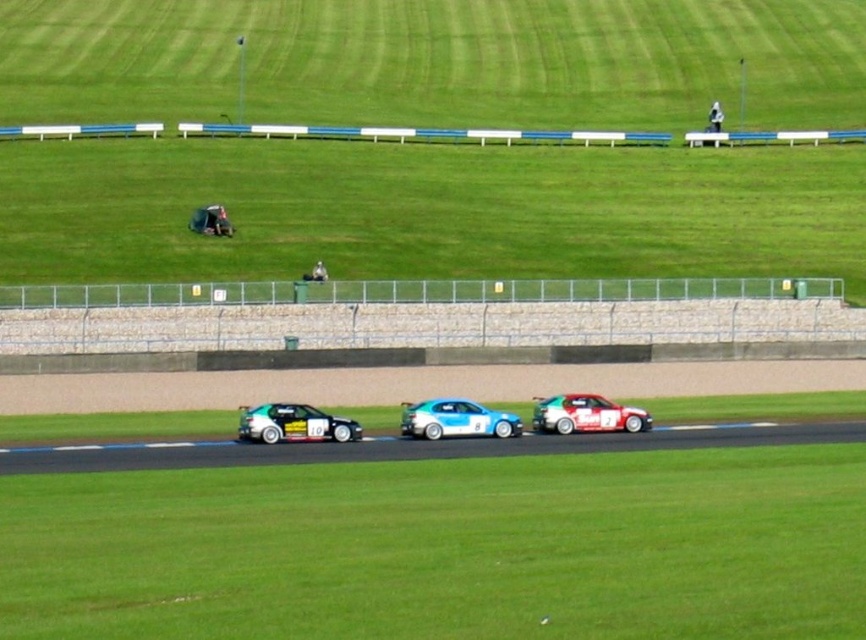
You are a drone operator tasked with capturing aerial footage of the green matte race car at center and the matte blue race car at upper center during the race. The drone has a maximum range of 100 feet. Can the drone safely capture footage of both cars simultaneously without exceeding its range limit?

The distance between the green matte race car at center and the matte blue race car at upper center is 86.60 feet. Since the drone has a maximum range of 100 feet, it can safely capture footage of both cars simultaneously as the distance between them is within the drone operator range limit.

Based on the scene description, can you determine the relative positioning of the smooth asphalt race track at center and the matte blue race car at upper center?

The smooth asphalt race track at center is positioned to the right of the matte blue race car at upper center.